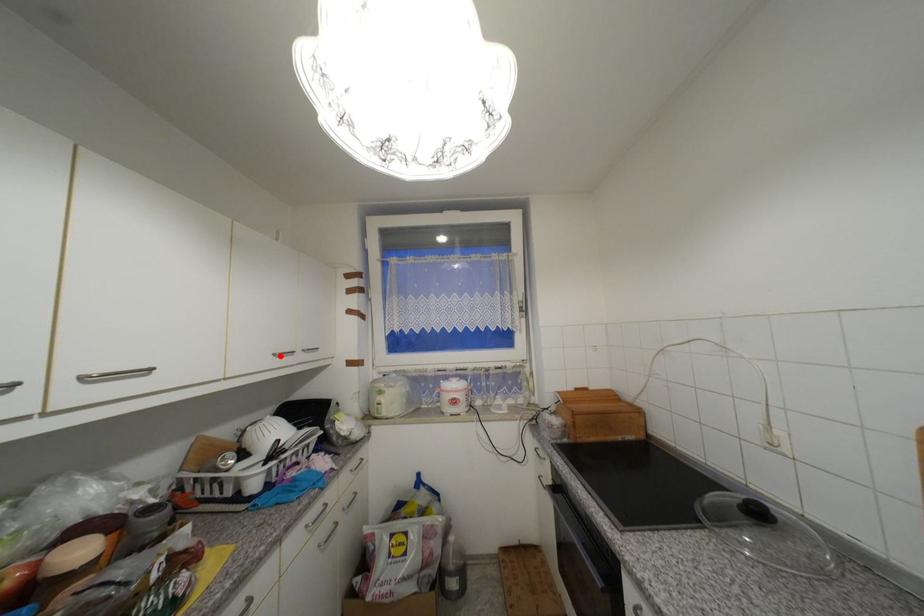
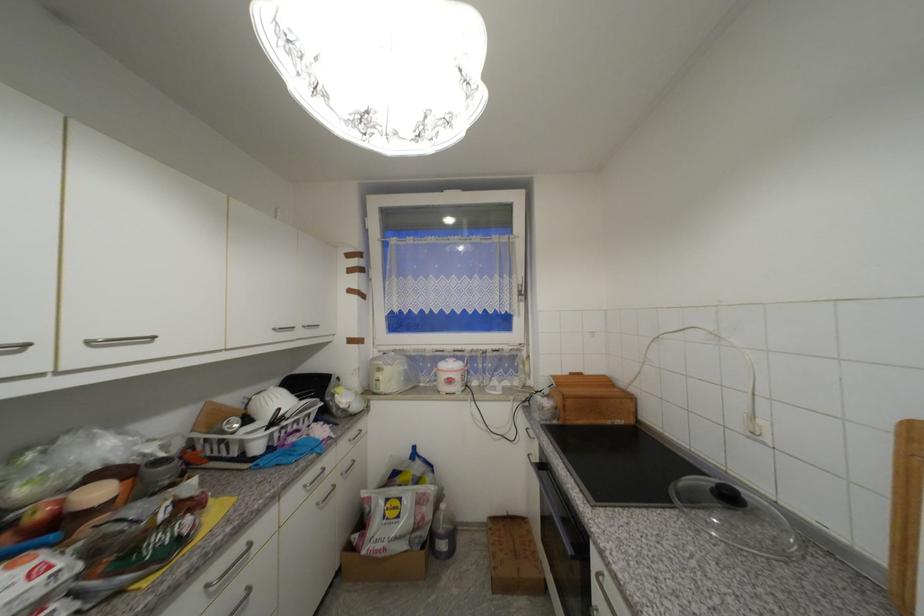
Find the pixel in the second image that matches the highlighted location in the first image.

(281, 331)